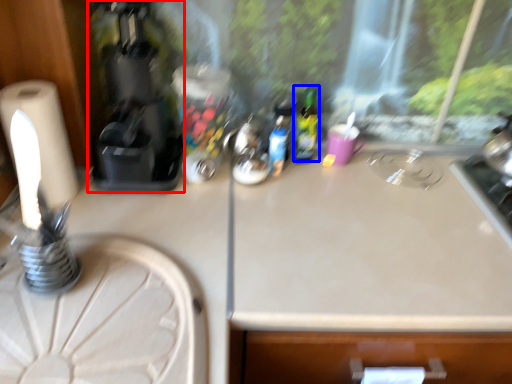
Question: Among these objects, which one is farthest to the camera, coffee machine (highlighted by a red box) or bottle (highlighted by a blue box)?

Choices:
 (A) coffee machine
 (B) bottle

Answer: (B)